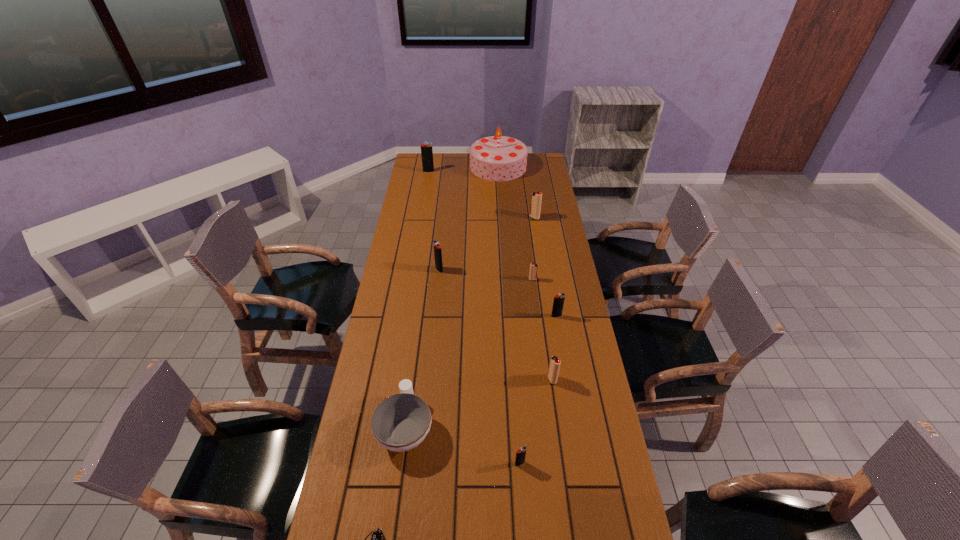
Identify the location of vacant area between the biggest red igniter and the white chinaware. (469, 322).

Where is `empty space between the smallest red igniter and the third farthest object`? The width and height of the screenshot is (960, 540). empty space between the smallest red igniter and the third farthest object is located at coordinates (534, 248).

Where is `unoccupied position between the fourth nearest igniter and the sixth farthest object`? This screenshot has width=960, height=540. unoccupied position between the fourth nearest igniter and the sixth farthest object is located at coordinates (544, 298).

Where is `vacant space that is in between the biggest black igniter and the smallest black igniter`? The height and width of the screenshot is (540, 960). vacant space that is in between the biggest black igniter and the smallest black igniter is located at coordinates (474, 318).

In order to click on vacant area that lies between the smallest black igniter and the second farthest igniter in this screenshot , I will do tap(527, 341).

Select which object appears as the seventh closest to the third igniter from left to right. Please provide its 2D coordinates. Your answer should be formatted as a tuple, i.e. [(x, y)], where the tuple contains the x and y coordinates of a point satisfying the conditions above.

[(536, 198)]

Identify the location of object that is the closest to the shortest object. (401, 422).

I want to click on igniter identified as the fourth closest to the white chinaware, so click(x=437, y=248).

The width and height of the screenshot is (960, 540). I want to click on the fourth closest igniter to the birthday cake, so [533, 272].

I want to click on black igniter that can be found as the third closest to the birthday cake, so (558, 302).